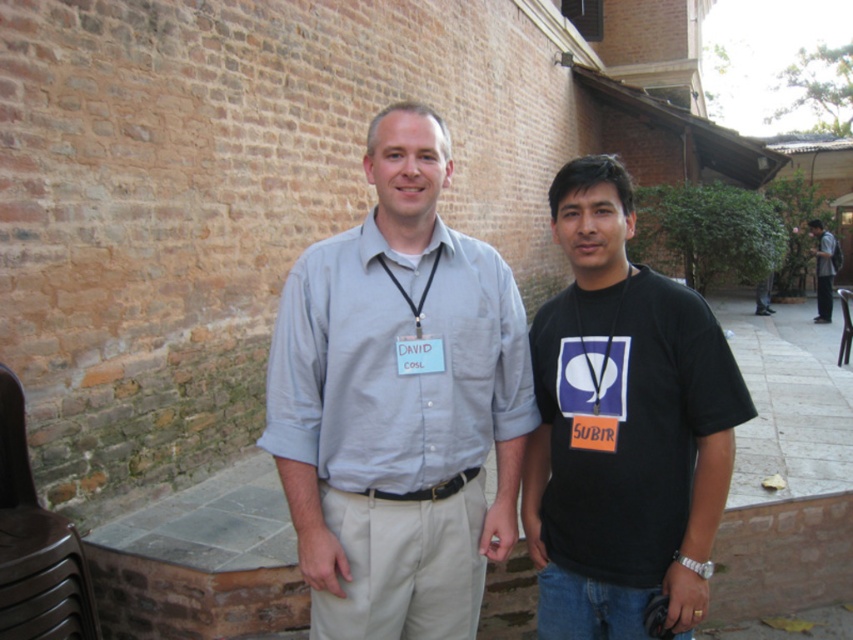
Can you confirm if light blue cotton shirt at center is positioned to the right of black matte t-shirt at center?

Incorrect, light blue cotton shirt at center is not on the right side of black matte t-shirt at center.

Who is more distant from viewer, (445, 349) or (672, 339)?

Point (445, 349)

Image resolution: width=853 pixels, height=640 pixels. Identify the location of light blue cotton shirt at center. (398, 403).

Can you confirm if black matte t-shirt at center is positioned below gray fabric shirt at center?

Yes, black matte t-shirt at center is below gray fabric shirt at center.

How far apart are black matte t-shirt at center and gray fabric shirt at center?

black matte t-shirt at center is 41.38 feet away from gray fabric shirt at center.

Where is `black matte t-shirt at center`? The width and height of the screenshot is (853, 640). black matte t-shirt at center is located at coordinates (624, 426).

Is light blue cotton shirt at center taller than gray fabric shirt at center?

Incorrect, light blue cotton shirt at center's height is not larger of gray fabric shirt at center's.

Measure the distance between light blue cotton shirt at center and camera.

light blue cotton shirt at center is 6.99 feet from camera.

Where is `light blue cotton shirt at center`? Image resolution: width=853 pixels, height=640 pixels. light blue cotton shirt at center is located at coordinates (398, 403).